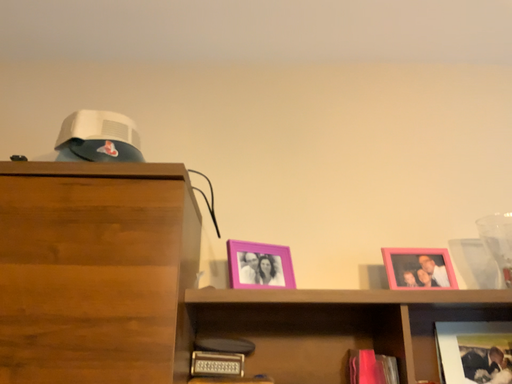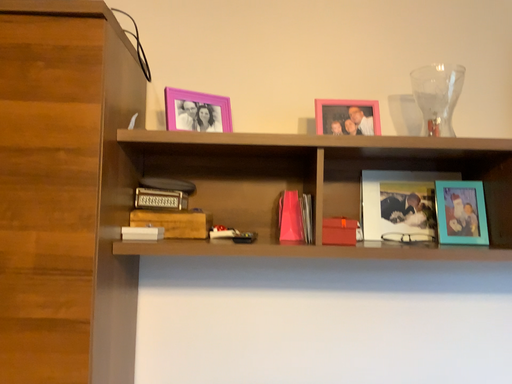
Question: Which way did the camera rotate in the video?

Choices:
 (A) rotated downward
 (B) rotated upward

Answer: (A)